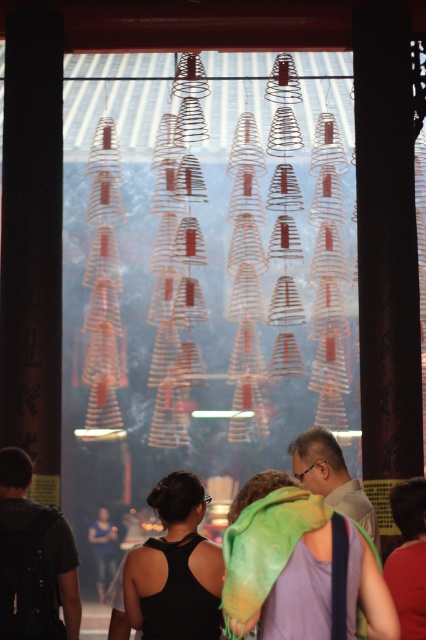
Which is below, black matte tank top at lower center or black backpack at lower left?

black backpack at lower left

Does black matte tank top at lower center have a greater height compared to black backpack at lower left?

Yes.

Which is in front, point (183, 604) or point (22, 492)?

Point (183, 604) is more forward.

Locate an element on the screen. black matte tank top at lower center is located at coordinates (175, 568).

Who is more distant from viewer, (52,580) or (98,598)?

Positioned behind is point (98,598).

In order to click on black backpack at lower left in this screenshot , I will do `click(63, 570)`.

At what (x,y) coordinates should I click in order to perform the action: click on black backpack at lower left. Please return your answer as a coordinate pair (x, y). Image resolution: width=426 pixels, height=640 pixels. Looking at the image, I should click on (63, 570).

Can you confirm if red fabric at lower right is bigger than matte black shirt at center?

Yes.

Who is more distant from viewer, [391,582] or [111,545]?

Point [111,545]

At what (x,y) coordinates should I click in order to perform the action: click on red fabric at lower right. Please return your answer as a coordinate pair (x, y). The image size is (426, 640). Looking at the image, I should click on (408, 557).